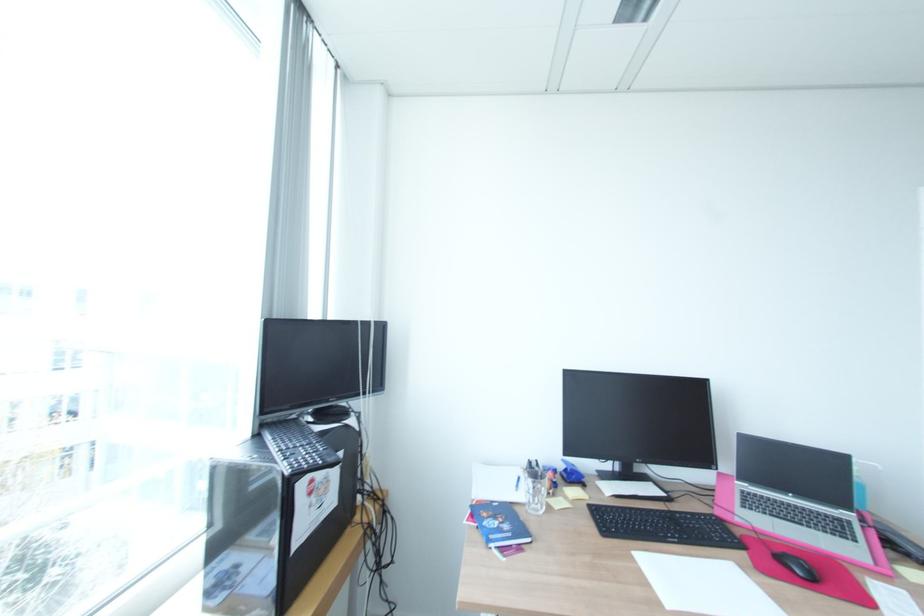
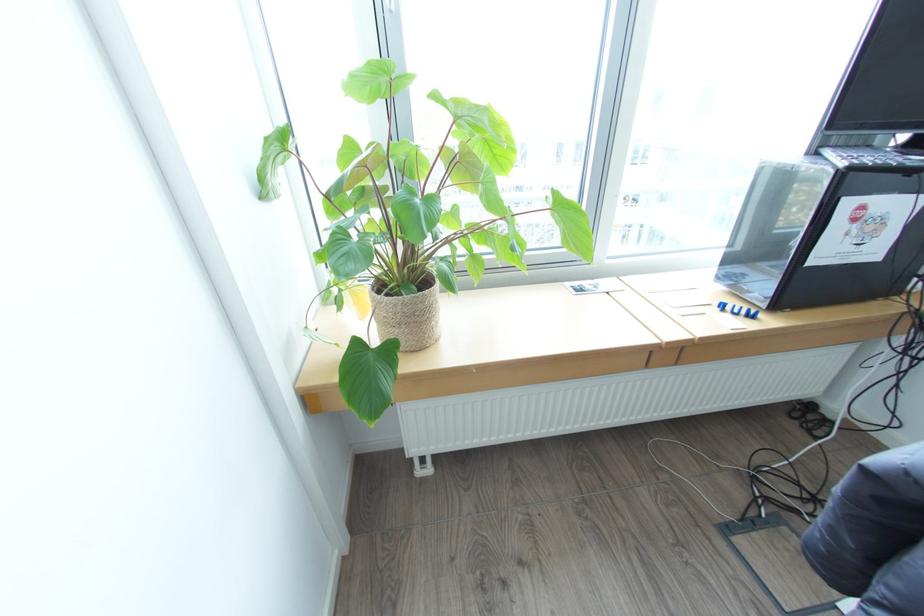
The first image is from the beginning of the video and the second image is from the end. How did the camera likely rotate when shooting the video?

The rotation direction of the camera is left-down.